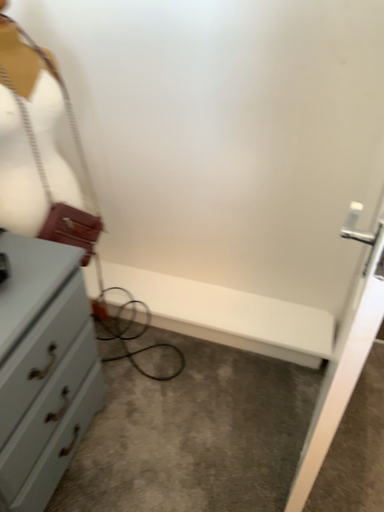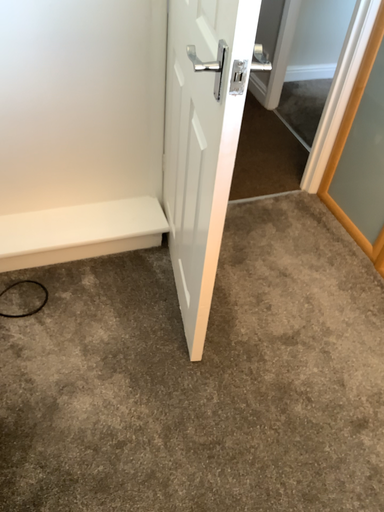
Question: How did the camera likely rotate when shooting the video?

Choices:
 (A) rotated right
 (B) rotated left

Answer: (A)